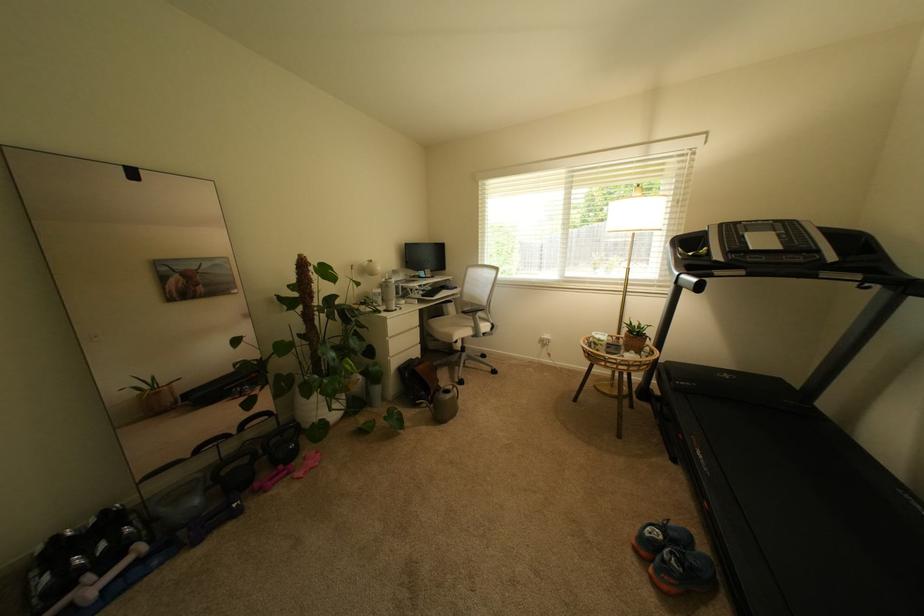
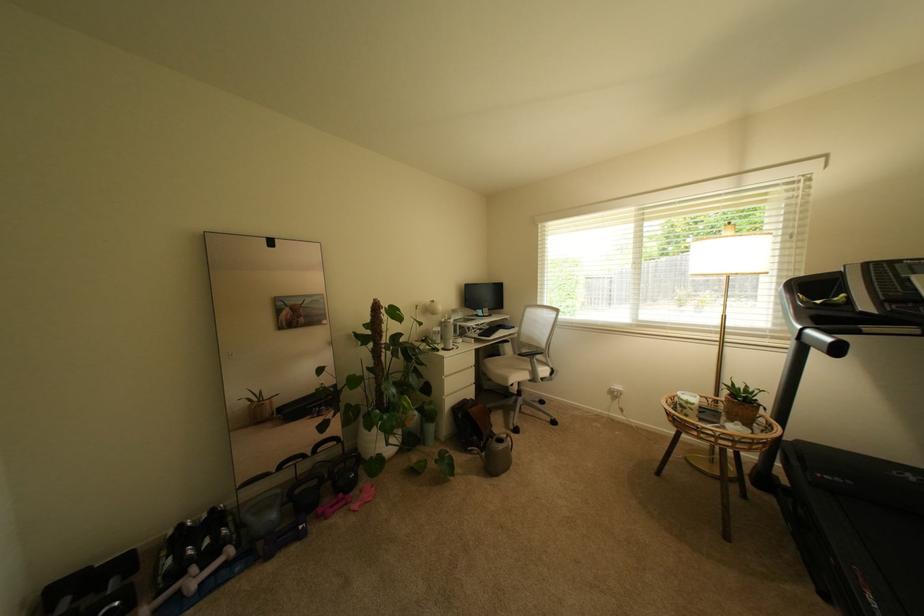
Question: I am providing you with two images of the same scene from different viewpoints. Which of the following objects are not visible in image2?

Choices:
 (A) gray kettlebell
 (B) black dumbbell
 (C) floor lamp switch
 (D) none of these

Answer: (D)